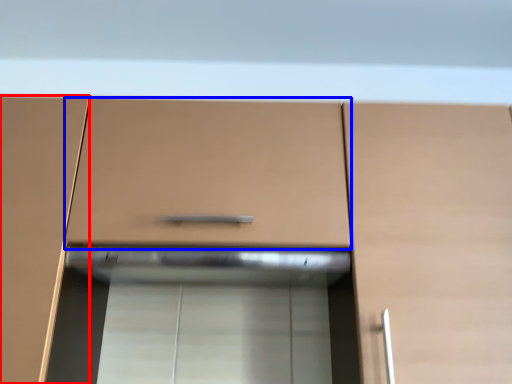
Question: Among these objects, which one is nearest to the camera, cabinetry (highlighted by a red box) or drawer (highlighted by a blue box)?

Choices:
 (A) cabinetry
 (B) drawer

Answer: (A)